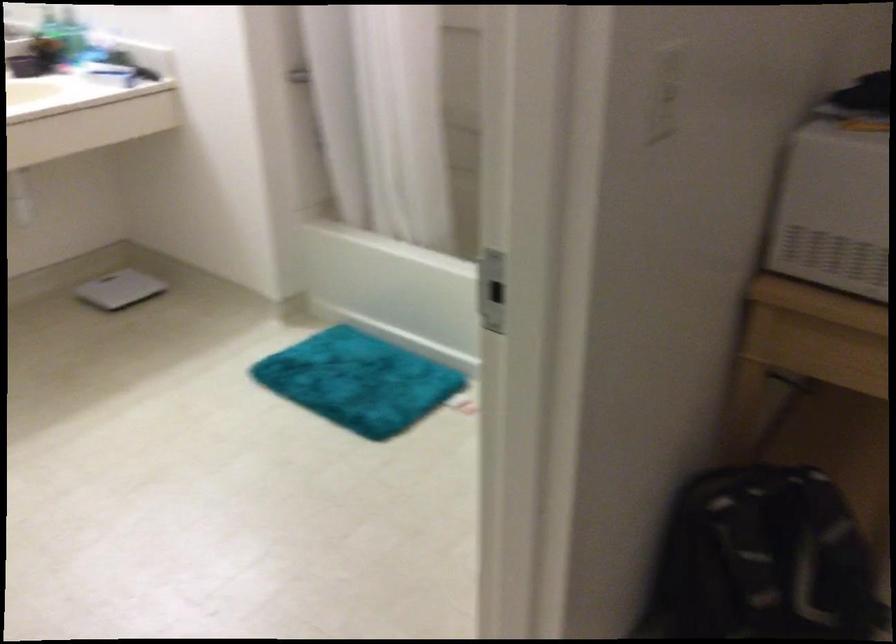
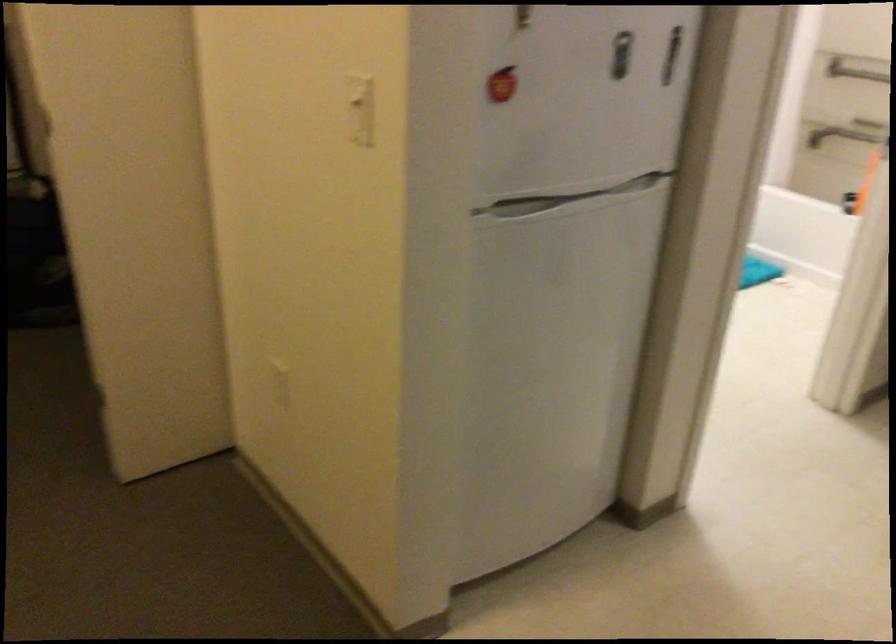
Question: I am providing you with two images of the same scene from different viewpoints. Please identify which objects are invisible in image2.

Choices:
 (A) red apple magnet
 (B) refrigerator handle
 (C) white bathroom scale
 (D) black soda bottle

Answer: (C)